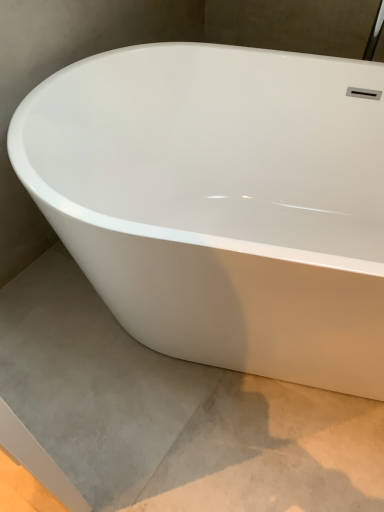
Question: Does point (187, 231) appear closer or farther from the camera than point (158, 366)?

Choices:
 (A) closer
 (B) farther

Answer: (A)

Question: Relative to gray concrete at lower left, is white glossy bathtub at center in front or behind?

Choices:
 (A) behind
 (B) front

Answer: (B)

Question: Considering the positions of white glossy bathtub at center and gray concrete at lower left in the image, is white glossy bathtub at center bigger or smaller than gray concrete at lower left?

Choices:
 (A) small
 (B) big

Answer: (B)

Question: In terms of width, does gray concrete at lower left look wider or thinner when compared to white glossy bathtub at center?

Choices:
 (A) wide
 (B) thin

Answer: (B)

Question: Considering the positions of point (24, 320) and point (210, 181), is point (24, 320) closer or farther from the camera than point (210, 181)?

Choices:
 (A) closer
 (B) farther

Answer: (A)

Question: Relative to white glossy bathtub at center, is gray concrete at lower left in front or behind?

Choices:
 (A) front
 (B) behind

Answer: (B)

Question: From a real-world perspective, relative to white glossy bathtub at center, is gray concrete at lower left vertically above or below?

Choices:
 (A) above
 (B) below

Answer: (B)